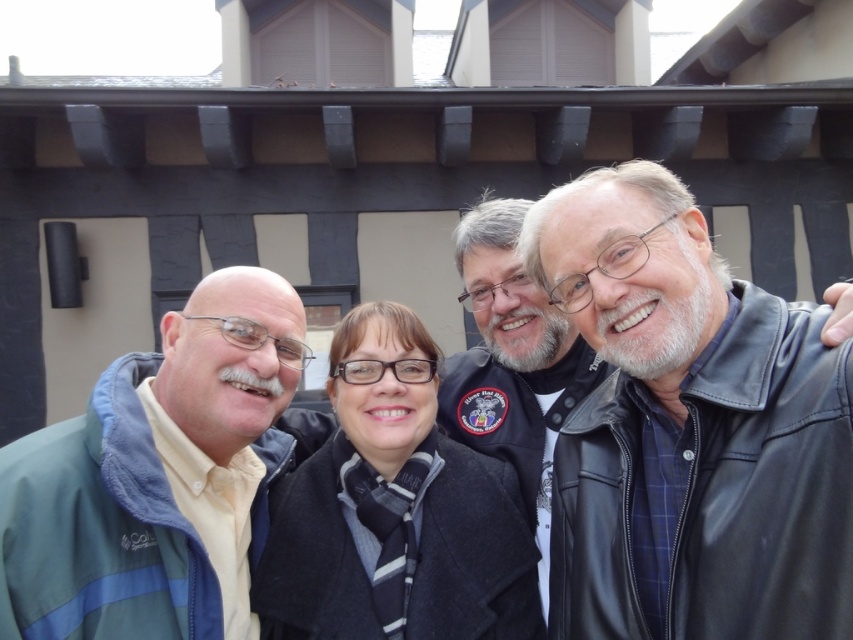
Question: In this image, where is green fleece jacket at left located relative to black leather jacket at center?

Choices:
 (A) left
 (B) right

Answer: (A)

Question: Among these objects, which one is nearest to the camera?

Choices:
 (A) leather jacket at right
 (B) black leather jacket at center
 (C) dark gray wool coat at center

Answer: (A)

Question: Which point is closer to the camera?

Choices:
 (A) leather jacket at right
 (B) black leather jacket at center
 (C) green fleece jacket at left
 (D) dark gray wool coat at center

Answer: (A)

Question: Can you confirm if leather jacket at right is thinner than black leather jacket at center?

Choices:
 (A) yes
 (B) no

Answer: (B)

Question: Can you confirm if green fleece jacket at left is positioned below dark gray wool coat at center?

Choices:
 (A) no
 (B) yes

Answer: (A)

Question: Which of the following is the farthest from the observer?

Choices:
 (A) (405, 580)
 (B) (645, 465)
 (C) (523, 200)

Answer: (C)